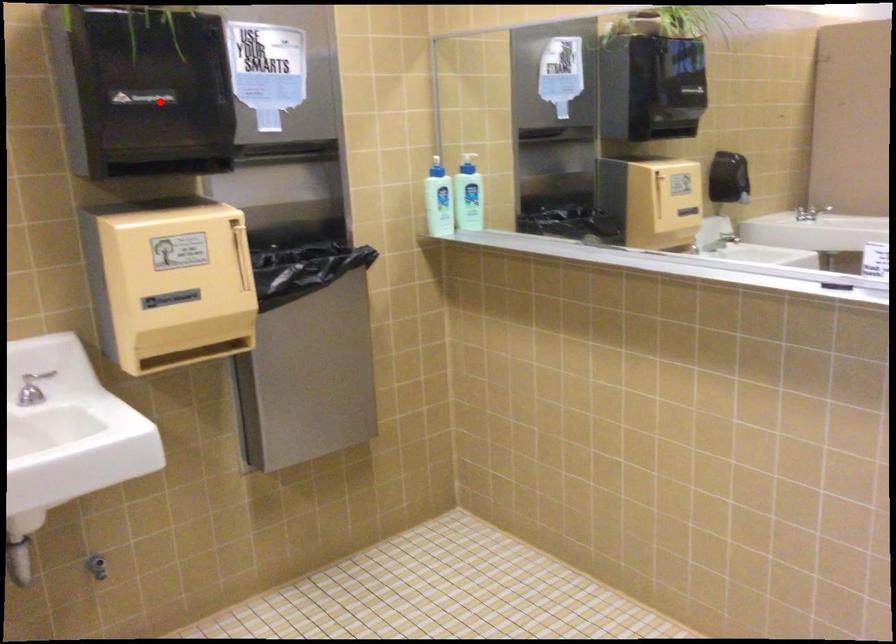
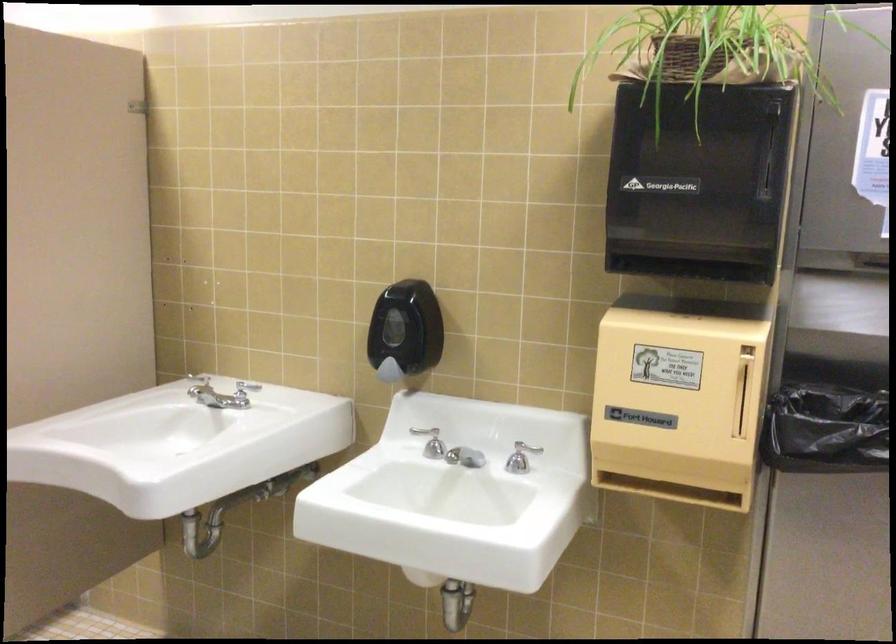
Question: I am providing you with two images of the same scene from different viewpoints. A red point is marked on the first image. Can you still see the location of the red point in image 2?

Choices:
 (A) Yes
 (B) No

Answer: (A)